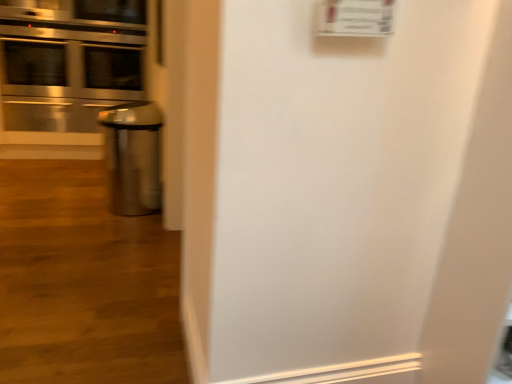
I want to click on shiny metallic trash can at center, so click(133, 157).

The image size is (512, 384). Describe the element at coordinates (133, 157) in the screenshot. I see `shiny metallic trash can at center` at that location.

The height and width of the screenshot is (384, 512). I want to click on shiny metallic trash can at center, so click(x=133, y=157).